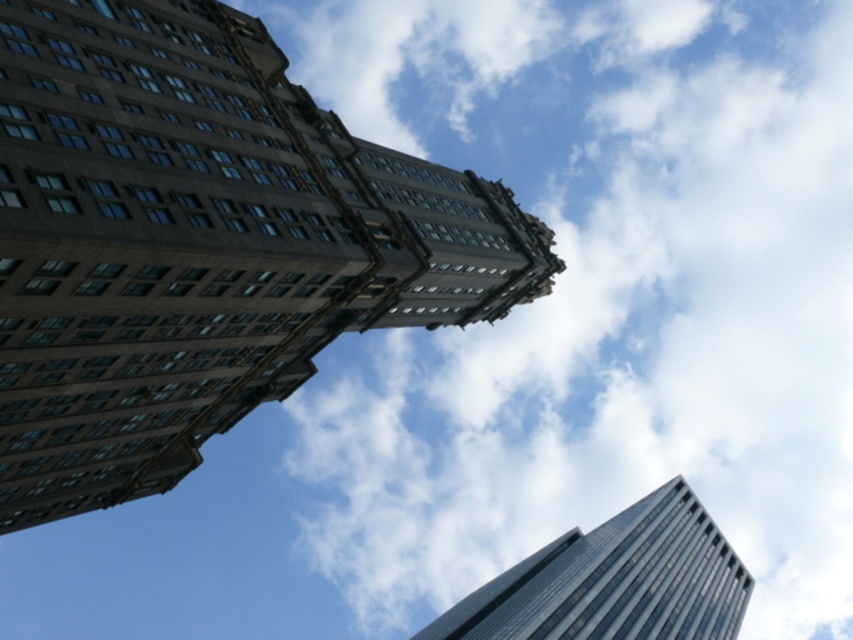
You are an architect analyzing the spatial relationship between the brown stone tower at upper left and the modern glass skyscraper on the right. Based on their positions in the image, which building is positioned higher up in the frame?

The brown stone tower at upper left is located at point (199, 243), which is higher up in the frame compared to the modern glass skyscraper on the right, so the brown stone tower at upper left is positioned higher.

You are standing on the ground looking up at the two buildings in the image. There is a point marked at coordinates (596, 296). Based on the scene description, what object or feature is located at that point?

The point at coordinates (596, 296) corresponds to the white fluffy cloud at upper center.

You are an architect analyzing the image. You need to determine if the white fluffy cloud at upper center can completely cover the glassy reflective skyscraper at lower right if it were to move directly above it. Based on their sizes, what would you conclude?

The white fluffy cloud at upper center might be wider than the glassy reflective skyscraper at lower right, so it could potentially cover it depending on its exact dimensions and positioning.